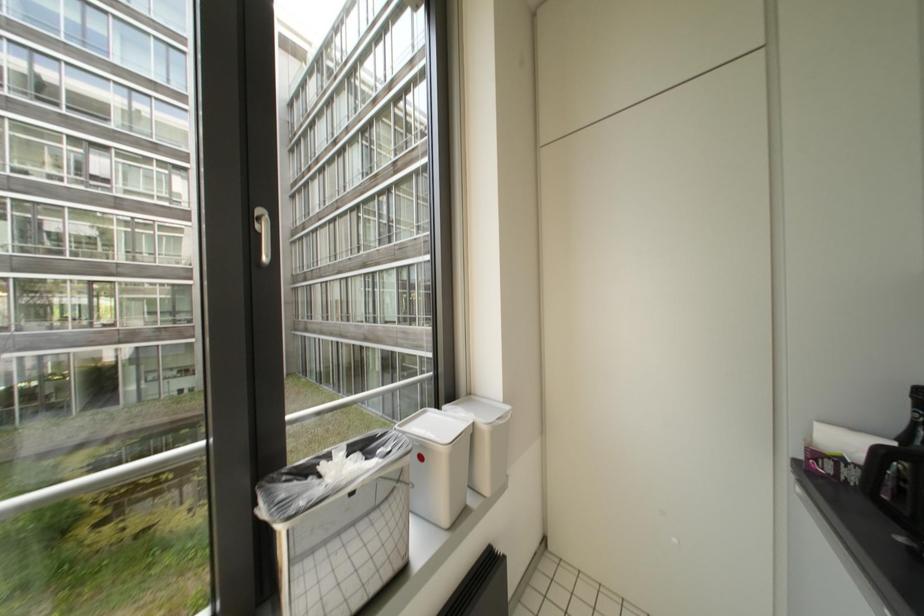
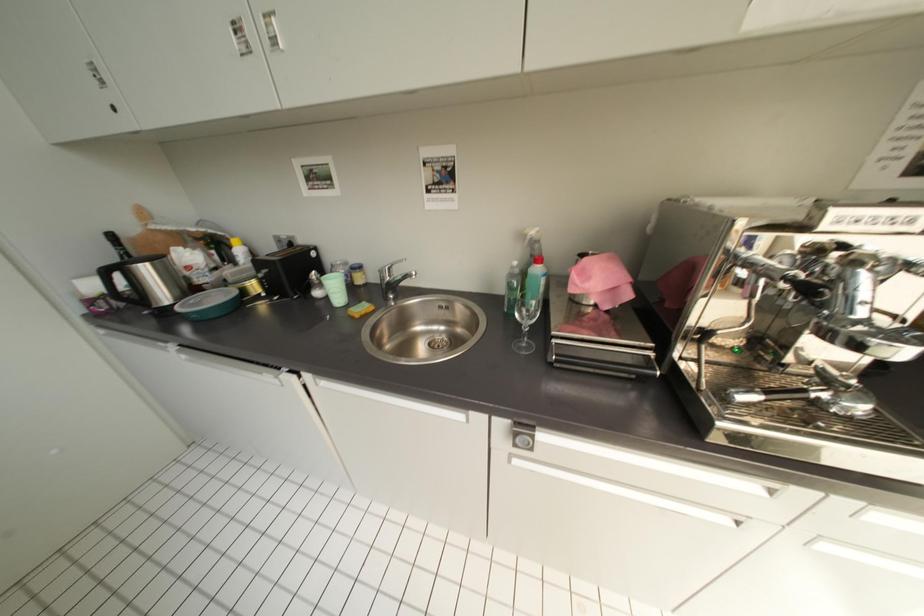
The first image is from the beginning of the video and the second image is from the end. How did the camera likely rotate when shooting the video?

The rotation direction of the camera is right-down.